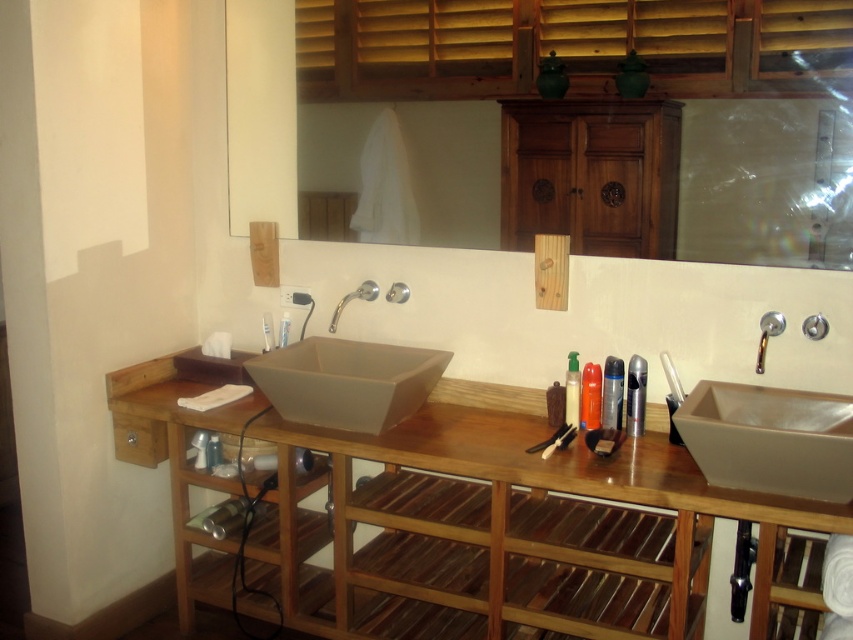
From the picture: You are standing in the bathroom and want to place a new toothpaste tube on the wooden vanity at center. Where exactly should you place it?

You should place the new toothpaste tube on the wooden vanity at center at point coordinates approximately 0.811 on the x axis and 0.533 on the y axis.

You are organizing a bathroom and need to place a large decorative item. Which object, the wooden vanity at center or the silver metallic faucet at upper right, would be more suitable to place the item on top of?

The wooden vanity at center is bigger than the silver metallic faucet at upper right, so the wooden vanity at center would be more suitable to place the large decorative item on top of.

You are standing in front of the bathroom vanity and want to reach both the point at coordinates (x=485, y=419) and the point at coordinates (x=757, y=355). Which point is closer to you?

The point at coordinates (x=485, y=419) is closer to you because it is further to the camera than the point at coordinates (x=757, y=355).